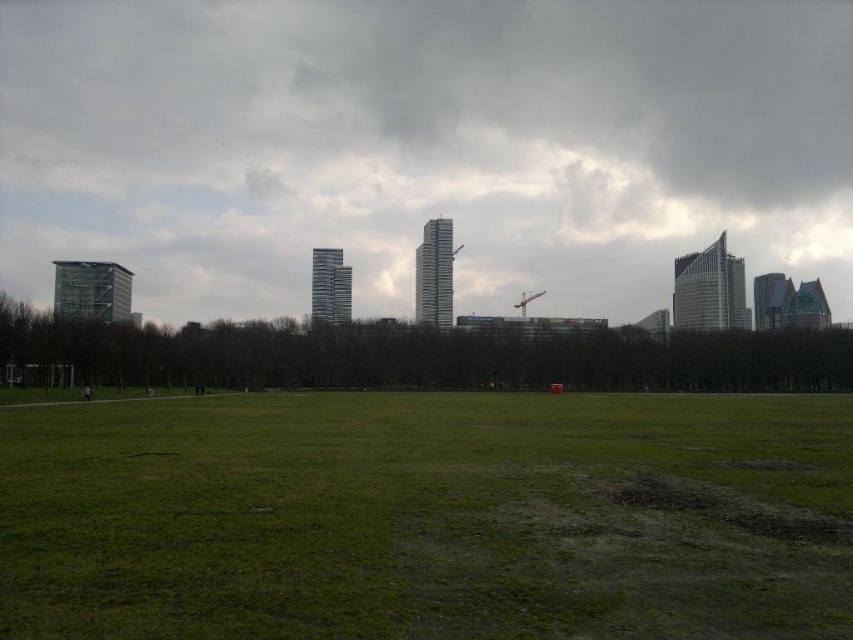
Based on the photo, which is above, white fluffy cloud at upper center or green grass at center?

white fluffy cloud at upper center

Which is behind, point (128, 1) or point (305, 550)?

The point (128, 1) is behind.

Where is `white fluffy cloud at upper center`? The width and height of the screenshot is (853, 640). white fluffy cloud at upper center is located at coordinates click(422, 147).

Locate an element on the screen. The image size is (853, 640). white fluffy cloud at upper center is located at coordinates (422, 147).